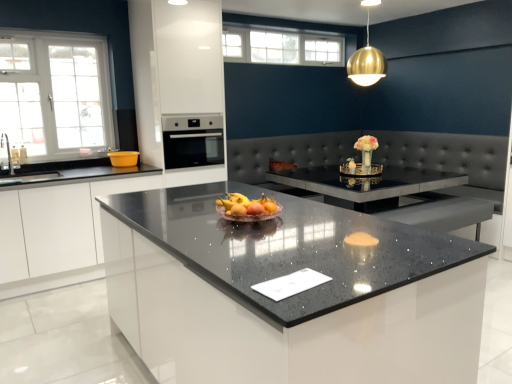
Question: Is white glass window at upper left, the 1th window in the front-to-back sequence, aimed at gold metallic sphere at upper center?

Choices:
 (A) yes
 (B) no

Answer: (B)

Question: Could gold metallic sphere at upper center be considered to be inside white glass window at upper left, the 1th window in the front-to-back sequence?

Choices:
 (A) no
 (B) yes

Answer: (A)

Question: From a real-world perspective, is white glass window at upper left, arranged as the first window when ordered from the bottom, positioned under gold metallic sphere at upper center based on gravity?

Choices:
 (A) no
 (B) yes

Answer: (B)

Question: From a real-world perspective, is white glass window at upper left, which is the 1th window in left-to-right order, over gold metallic sphere at upper center?

Choices:
 (A) no
 (B) yes

Answer: (A)

Question: Is white glass window at upper left, which is the 2th window from right to left, turned away from gold metallic sphere at upper center?

Choices:
 (A) no
 (B) yes

Answer: (A)

Question: Is white glass window at upper left, arranged as the second window when viewed from the top, directly adjacent to gold metallic sphere at upper center?

Choices:
 (A) no
 (B) yes

Answer: (A)

Question: Does white glossy cabinet at left have a lesser height compared to white glass window at upper left, which is the 1th window in left-to-right order?

Choices:
 (A) yes
 (B) no

Answer: (A)

Question: Does white glossy cabinet at left turn towards white glass window at upper left, arranged as the first window when ordered from the bottom?

Choices:
 (A) no
 (B) yes

Answer: (A)

Question: Is white glossy cabinet at left at the right side of white glass window at upper left, which is the 2th window from right to left?

Choices:
 (A) yes
 (B) no

Answer: (A)

Question: Does white glossy cabinet at left appear on the left side of white glass window at upper left, which is the 2th window from back to front?

Choices:
 (A) no
 (B) yes

Answer: (A)

Question: Is white glossy cabinet at left positioned in front of white glass window at upper left, which is the 2th window from right to left?

Choices:
 (A) yes
 (B) no

Answer: (A)

Question: From a real-world perspective, is white glossy cabinet at left beneath white glass window at upper left, which is the 2th window from back to front?

Choices:
 (A) yes
 (B) no

Answer: (A)

Question: Does sparkling granite countertop at center have a smaller size compared to satin black oven at center?

Choices:
 (A) no
 (B) yes

Answer: (A)